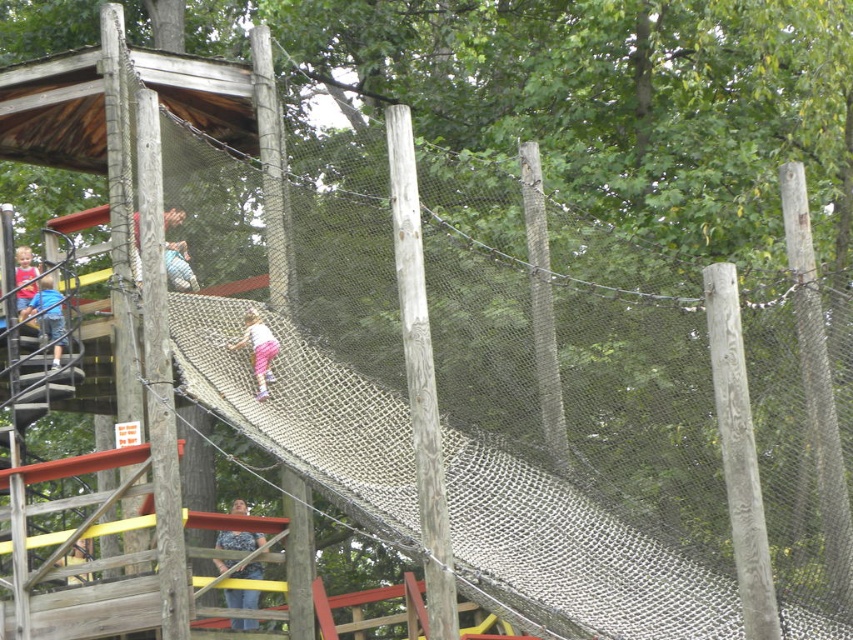
Question: Is blue fabric at left behind pink fabric pants at center?

Choices:
 (A) no
 (B) yes

Answer: (B)

Question: Which is farther from the matte pink pants at left?

Choices:
 (A) pink fabric pants at center
 (B) blue fabric at left

Answer: (A)

Question: Among these points, which one is farthest from the camera?

Choices:
 (A) (250, 572)
 (B) (28, 305)
 (C) (173, 259)

Answer: (B)

Question: In this image, where is blue denim jeans at upper center located relative to pink fabric pants at center?

Choices:
 (A) below
 (B) above

Answer: (B)

Question: From the image, what is the correct spatial relationship of blue fabric at left in relation to pink fabric pants at center?

Choices:
 (A) left
 (B) right

Answer: (A)

Question: Which point is closer to the camera taking this photo?

Choices:
 (A) (228, 536)
 (B) (55, 310)

Answer: (B)